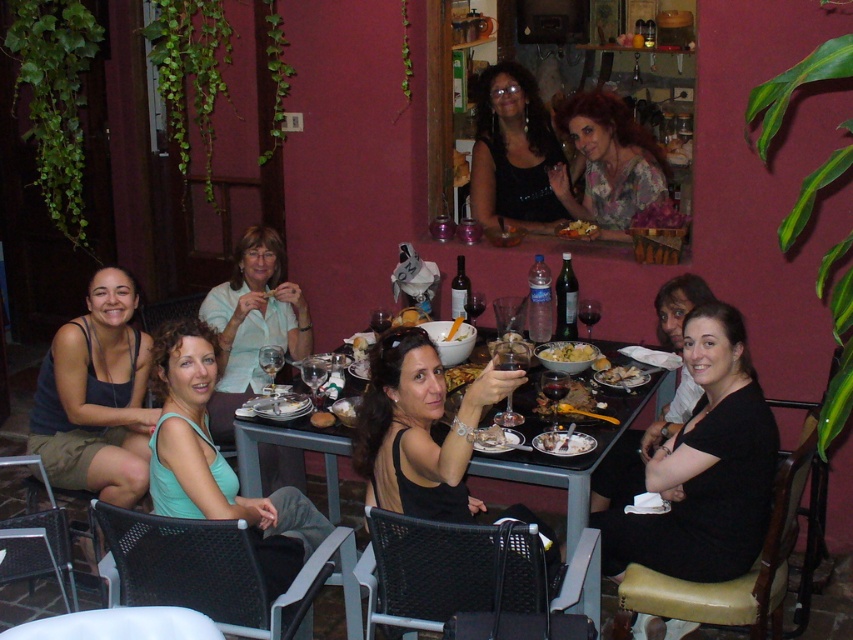
Question: Considering the relative positions of floral-patterned blouse at upper center and shiny silver bowl at center in the image provided, where is floral-patterned blouse at upper center located with respect to shiny silver bowl at center?

Choices:
 (A) left
 (B) right

Answer: (B)

Question: Which object is closer to the camera taking this photo?

Choices:
 (A) black matte dress at lower right
 (B) light blue fabric shirt at center

Answer: (A)

Question: Is floral-patterned blouse at upper center in front of yellow creamy pasta at center?

Choices:
 (A) no
 (B) yes

Answer: (A)

Question: Does wooden table at center have a smaller size compared to golden brown bread at center?

Choices:
 (A) no
 (B) yes

Answer: (A)

Question: Which point is farther from the camera taking this photo?

Choices:
 (A) (563, 236)
 (B) (706, 300)
 (C) (560, 444)
 (D) (325, 444)

Answer: (A)

Question: Among these objects, which one is nearest to the camera?

Choices:
 (A) yellow creamy pasta at center
 (B) golden brown bread at center
 (C) black matte dress at lower right

Answer: (C)